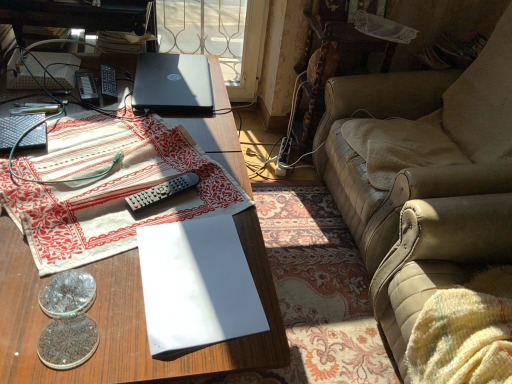
What are the coordinates of `free space to the back side of translucent glass coins at lower left, which is counted as the 2th coin, starting from the back` in the screenshot? It's located at (93, 259).